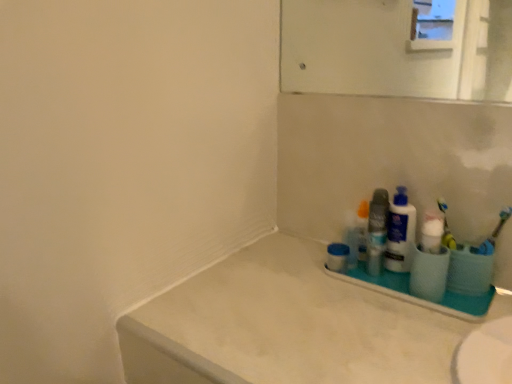
Identify the location of vacant space underneath white plastic tray at lower right (from a real-world perspective). The height and width of the screenshot is (384, 512). (404, 287).